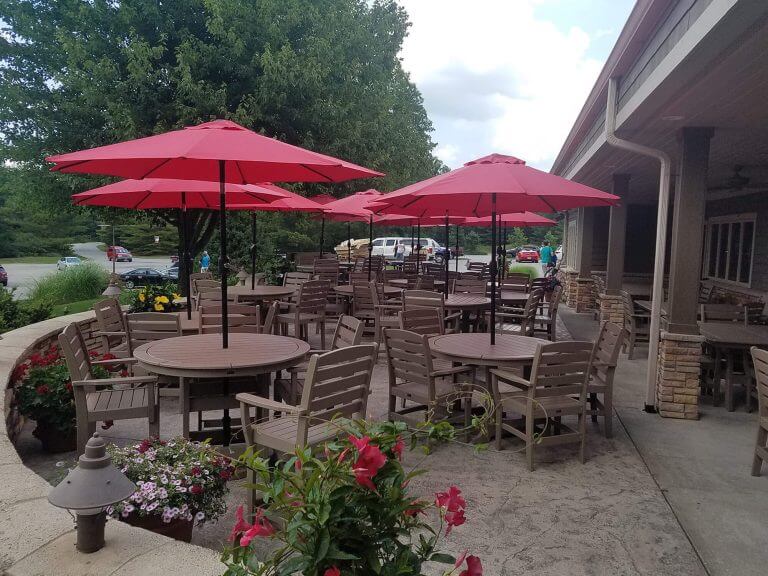
The width and height of the screenshot is (768, 576). In order to click on light in this screenshot , I will do `click(100, 521)`, `click(114, 291)`, `click(243, 278)`.